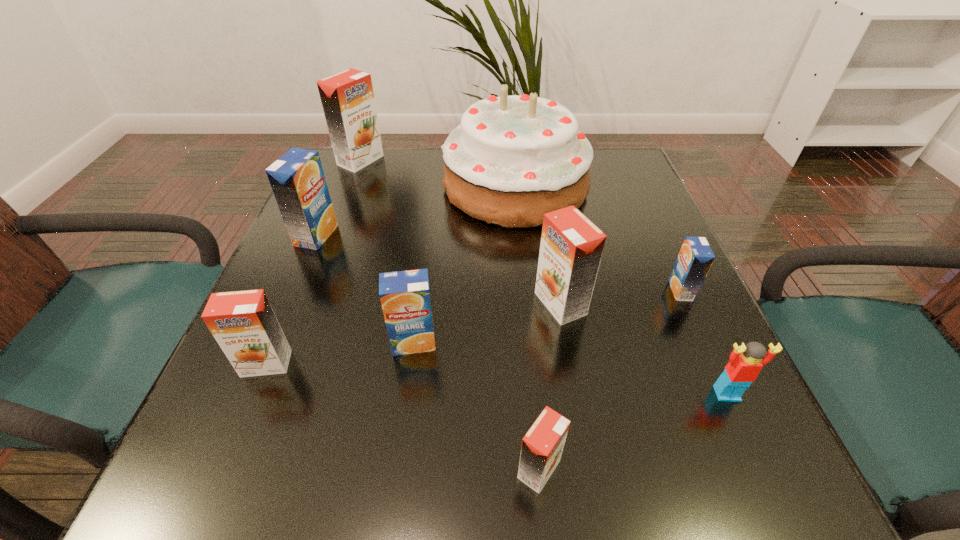
Identify the location of Lego. The width and height of the screenshot is (960, 540). (742, 370).

What are the coordinates of `the second nearest blue orange_juice` in the screenshot? It's located at (695, 258).

You are a GUI agent. You are given a task and a screenshot of the screen. Output one action in this format:
    pyautogui.click(x=<x>, y=<y>)
    Task: Click on the smallest blue orange_juice
    This screenshot has width=960, height=540.
    Given the screenshot: What is the action you would take?
    pyautogui.click(x=695, y=258)

Find the location of `the nearest object`. the nearest object is located at coordinates (542, 446).

Locate an element on the screen. The image size is (960, 540). the smallest orange orange juice is located at coordinates (542, 446).

Identify the location of vacant space located 0.240m on the front of the red cake. (x=528, y=314).

At what (x,y) coordinates should I click in order to perform the action: click on vacant area situated on the front of the tallest orange juice. Please return your answer as a coordinate pair (x, y). Looking at the image, I should click on (327, 246).

Find the location of `vacant space located on the front of the biggest blue orange_juice`. vacant space located on the front of the biggest blue orange_juice is located at coordinates (259, 370).

Locate an element on the screen. The height and width of the screenshot is (540, 960). free location located 0.230m on the back of the second farthest orange orange juice is located at coordinates (544, 212).

Find the location of a particular element. The image size is (960, 540). blank space located 0.310m on the back of the third biggest orange orange juice is located at coordinates (321, 233).